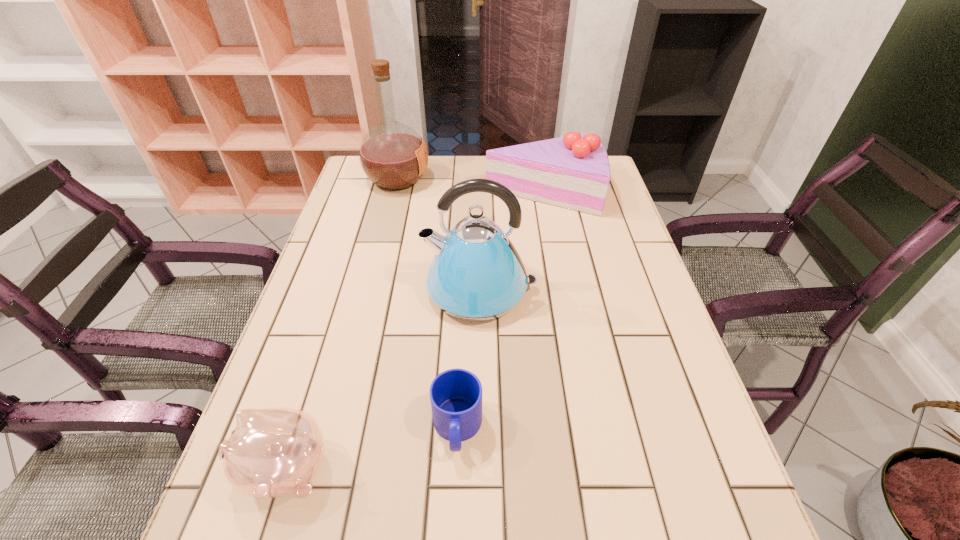
Identify the location of vacant point located 0.260m on the front of the cake. Image resolution: width=960 pixels, height=540 pixels. (559, 279).

You are a GUI agent. You are given a task and a screenshot of the screen. Output one action in this format:
    pyautogui.click(x=<x>, y=<y>)
    Task: Click on the vacant space situated 0.110m on the side with the handle of the mug
    Image resolution: width=960 pixels, height=540 pixels.
    Given the screenshot: What is the action you would take?
    pyautogui.click(x=453, y=532)

Find the location of a particular element. The image size is (960, 540). liquor located in the far edge section of the desktop is located at coordinates (393, 156).

At what (x,y) coordinates should I click in order to perform the action: click on cake situated at the far edge. Please return your answer as a coordinate pair (x, y). Looking at the image, I should click on (573, 172).

Where is `liquor located at the left edge`? The image size is (960, 540). liquor located at the left edge is located at coordinates (393, 156).

Where is `piggy bank that is at the left edge`? This screenshot has height=540, width=960. piggy bank that is at the left edge is located at coordinates (273, 452).

Where is `object that is at the right edge`? This screenshot has width=960, height=540. object that is at the right edge is located at coordinates (573, 172).

Where is `object located in the far left corner section of the desktop`? object located in the far left corner section of the desktop is located at coordinates (393, 156).

Where is `object that is at the far right corner`? This screenshot has width=960, height=540. object that is at the far right corner is located at coordinates (573, 172).

Locate an element on the screen. This screenshot has height=540, width=960. free space at the far edge of the desktop is located at coordinates (406, 191).